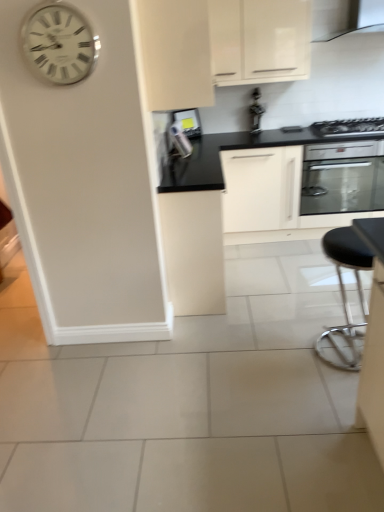
Question: Is black glossy exhaust hood at upper right not inside metallic silver toaster at upper center, which is the first appliance in right-to-left order?

Choices:
 (A) no
 (B) yes

Answer: (B)

Question: Would you say black glossy exhaust hood at upper right is a long distance from metallic silver toaster at upper center, which is the first appliance in right-to-left order?

Choices:
 (A) yes
 (B) no

Answer: (B)

Question: From the image's perspective, does black glossy exhaust hood at upper right appear higher than metallic silver toaster at upper center, positioned as the second appliance in left-to-right order?

Choices:
 (A) no
 (B) yes

Answer: (B)

Question: Is black glossy exhaust hood at upper right beside metallic silver toaster at upper center, which is the first appliance in right-to-left order?

Choices:
 (A) yes
 (B) no

Answer: (B)

Question: Is black glossy exhaust hood at upper right surrounding metallic silver toaster at upper center, which is the first appliance in right-to-left order?

Choices:
 (A) yes
 (B) no

Answer: (B)

Question: Is black glossy exhaust hood at upper right oriented towards metallic silver toaster at upper center, which is the first appliance in right-to-left order?

Choices:
 (A) yes
 (B) no

Answer: (B)

Question: Considering the relative sizes of satin black oven at upper right and metallic stainless steel oven at center-right in the image provided, is satin black oven at upper right thinner than metallic stainless steel oven at center-right?

Choices:
 (A) yes
 (B) no

Answer: (A)

Question: Is satin black oven at upper right to the left of metallic stainless steel oven at center-right from the viewer's perspective?

Choices:
 (A) yes
 (B) no

Answer: (B)

Question: Is satin black oven at upper right looking in the opposite direction of metallic stainless steel oven at center-right?

Choices:
 (A) no
 (B) yes

Answer: (A)

Question: Considering the relative sizes of satin black oven at upper right and metallic stainless steel oven at center-right in the image provided, is satin black oven at upper right bigger than metallic stainless steel oven at center-right?

Choices:
 (A) yes
 (B) no

Answer: (B)

Question: Is satin black oven at upper right in front of metallic stainless steel oven at center-right?

Choices:
 (A) no
 (B) yes

Answer: (A)

Question: Can you confirm if satin black oven at upper right is taller than metallic stainless steel oven at center-right?

Choices:
 (A) no
 (B) yes

Answer: (A)

Question: Is metallic silver toaster at upper center, acting as the second appliance starting from the right, facing towards matte white cabinet at center, arranged as the 3th cabinetry when viewed from the top?

Choices:
 (A) yes
 (B) no

Answer: (B)